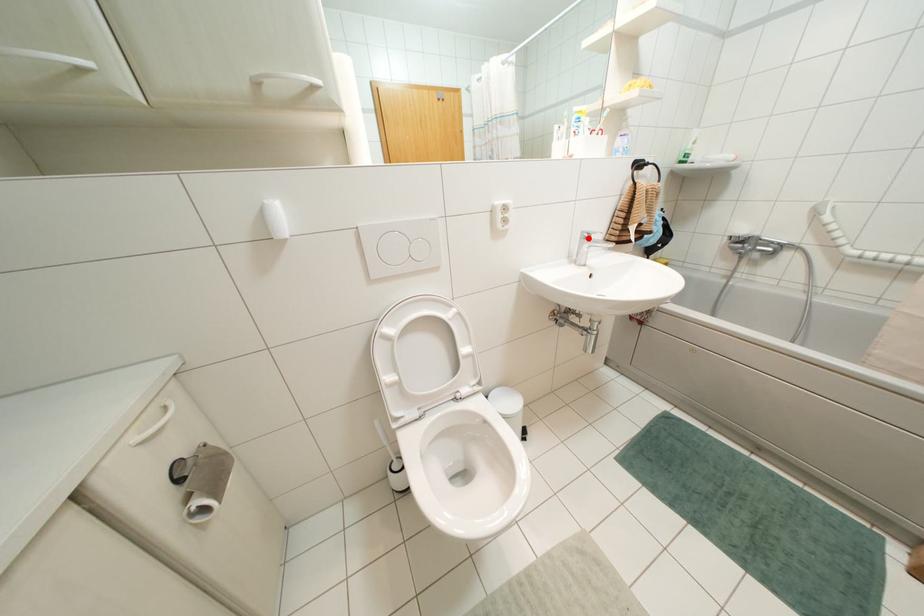
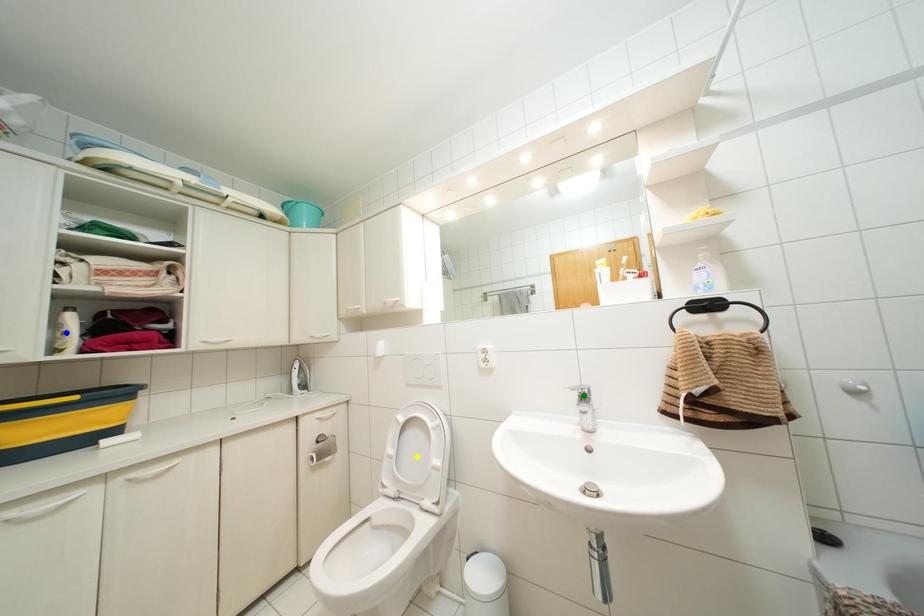
Question: I am providing you with two images of the same scene from different viewpoints. A red point is marked on the first image. You are given multiple points on the second image. Can you choose the point in image 2 that corresponds to the point in image 1?

Choices:
 (A) blue point
 (B) yellow point
 (C) green point

Answer: (C)